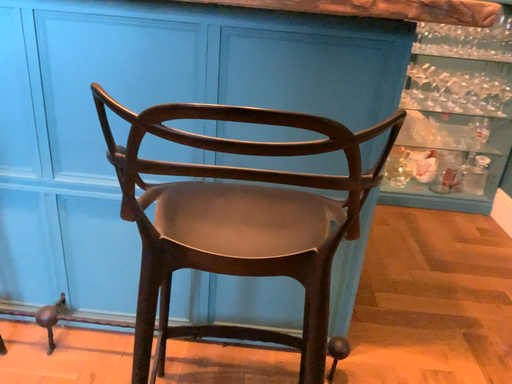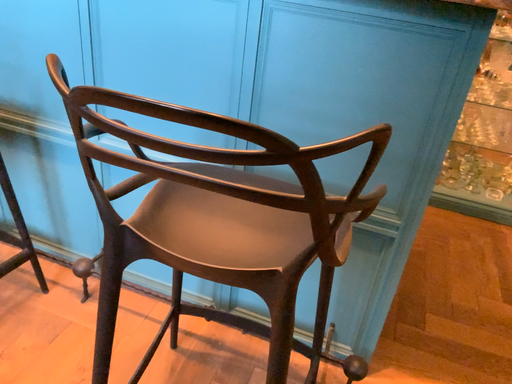
Question: How did the camera likely rotate when shooting the video?

Choices:
 (A) rotated left
 (B) rotated right

Answer: (A)